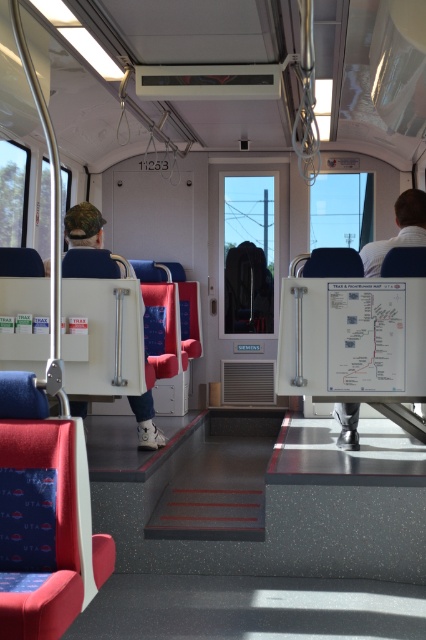
Question: Does white fabric shirt at right have a larger size compared to matte white cap at left?

Choices:
 (A) yes
 (B) no

Answer: (A)

Question: Does white fabric shirt at right lie in front of matte white cap at left?

Choices:
 (A) no
 (B) yes

Answer: (B)

Question: Observing the image, what is the correct spatial positioning of white fabric shirt at right in reference to matte white cap at left?

Choices:
 (A) right
 (B) left

Answer: (A)

Question: Which object is closer to the camera taking this photo?

Choices:
 (A) matte white cap at left
 (B) white fabric shirt at right

Answer: (B)

Question: Which point is closer to the camera?

Choices:
 (A) white fabric shirt at right
 (B) matte white cap at left

Answer: (A)